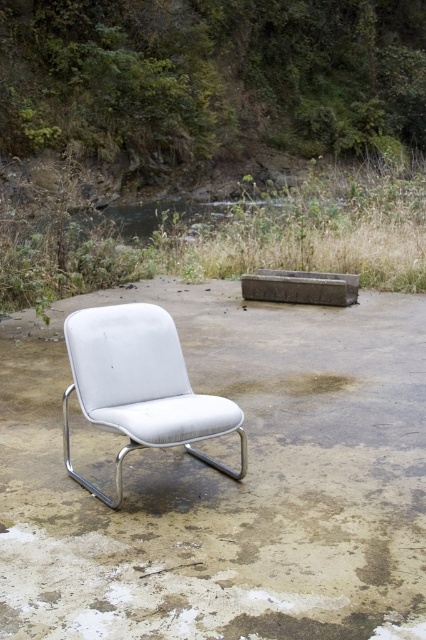
Question: Based on their relative distances, which object is nearer to the white leather chair at center?

Choices:
 (A) brown dirt at center
 (B) white fabric chair at center

Answer: (B)

Question: Does white leather chair at center have a larger size compared to brown dirt at center?

Choices:
 (A) yes
 (B) no

Answer: (B)

Question: Among these points, which one is nearest to the camera?

Choices:
 (A) (213, 513)
 (B) (210, 211)

Answer: (A)

Question: Is white fabric chair at center smaller than brown dirt at center?

Choices:
 (A) yes
 (B) no

Answer: (A)

Question: Is white leather chair at center in front of brown dirt at center?

Choices:
 (A) yes
 (B) no

Answer: (A)

Question: Among these objects, which one is farthest from the camera?

Choices:
 (A) white leather chair at center
 (B) brown dirt at center
 (C) white fabric chair at center

Answer: (B)